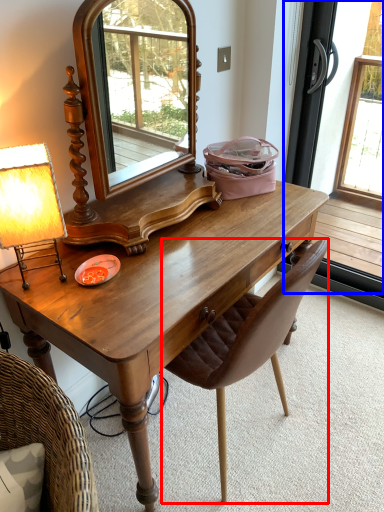
Question: Among these objects, which one is nearest to the camera, chair (highlighted by a red box) or screen door (highlighted by a blue box)?

Choices:
 (A) chair
 (B) screen door

Answer: (A)